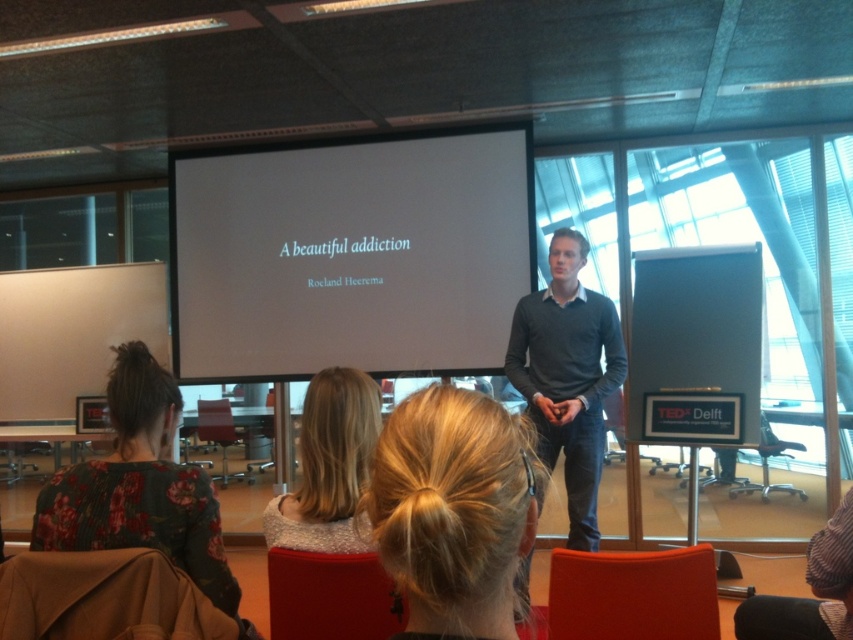
You are organizing a small event and need to rearrange the seating. If you want to move the black plastic chair at center closer to the floral fabric dress at lower left, how much distance would you need to cover to place them adjacent to each other?

The floral fabric dress at lower left and black plastic chair at center are currently 4.45 meters apart. To place them adjacent, you would need to move the black plastic chair at center by approximately 4.45 meters towards the floral fabric dress at lower left.

You are organizing a small event and need to determine seating arrangements. You have a floral fabric dress at lower left and a black plastic chair at center. Which object takes up more space?

The floral fabric dress at lower left is bigger than the black plastic chair at center, so it occupies more space.

You are standing in the conference room and notice two points marked on the wall. The first point is at coordinate point(521, 563) and the second is at point(621, 563). Which point is closer to the ceiling?

Point(621, 563) is higher up on the wall, so it is closer to the ceiling than point(521, 563).